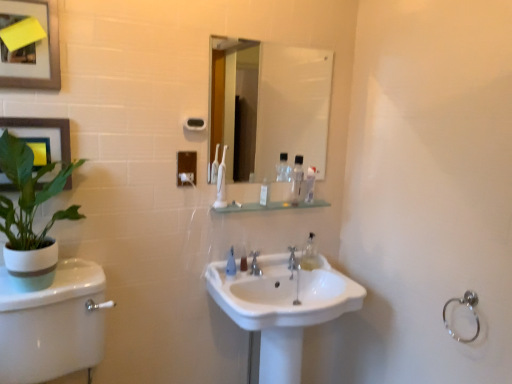
Question: Is there a large distance between white plastic tube at center and white glossy mirror at upper center?

Choices:
 (A) yes
 (B) no

Answer: (A)

Question: Considering the relative sizes of white plastic tube at center and white glossy mirror at upper center in the image provided, is white plastic tube at center thinner than white glossy mirror at upper center?

Choices:
 (A) no
 (B) yes

Answer: (A)

Question: Is white plastic tube at center further to the viewer compared to white glossy mirror at upper center?

Choices:
 (A) no
 (B) yes

Answer: (B)

Question: Is white plastic tube at center aimed at white glossy mirror at upper center?

Choices:
 (A) yes
 (B) no

Answer: (B)

Question: From a real-world perspective, is white plastic tube at center under white glossy mirror at upper center?

Choices:
 (A) no
 (B) yes

Answer: (B)

Question: Looking at the image, does silver metallic faucet at center seem bigger or smaller compared to white glossy mirror at upper center?

Choices:
 (A) big
 (B) small

Answer: (B)

Question: Would you say silver metallic faucet at center is to the left or to the right of white glossy mirror at upper center in the picture?

Choices:
 (A) left
 (B) right

Answer: (A)

Question: From a real-world perspective, is silver metallic faucet at center physically located above or below white glossy mirror at upper center?

Choices:
 (A) above
 (B) below

Answer: (B)

Question: From their relative heights in the image, would you say silver metallic faucet at center is taller or shorter than white glossy mirror at upper center?

Choices:
 (A) tall
 (B) short

Answer: (B)

Question: Based on their sizes in the image, would you say white plastic toothbrush at center is bigger or smaller than satin nickel faucet at center?

Choices:
 (A) small
 (B) big

Answer: (B)

Question: Does point (221, 195) appear closer or farther from the camera than point (293, 258)?

Choices:
 (A) farther
 (B) closer

Answer: (B)

Question: Would you say white plastic toothbrush at center is inside or outside satin nickel faucet at center?

Choices:
 (A) outside
 (B) inside

Answer: (A)

Question: Is white plastic toothbrush at center wider or thinner than satin nickel faucet at center?

Choices:
 (A) wide
 (B) thin

Answer: (A)

Question: Looking at their shapes, would you say clear plastic bottle at upper center, placed as the second mouthwash when sorted from left to right, is wider or thinner than silver metallic faucet at center?

Choices:
 (A) thin
 (B) wide

Answer: (B)

Question: Would you say clear plastic bottle at upper center, which is the 2th mouthwash in right-to-left order, is to the left or to the right of silver metallic faucet at center in the picture?

Choices:
 (A) right
 (B) left

Answer: (A)